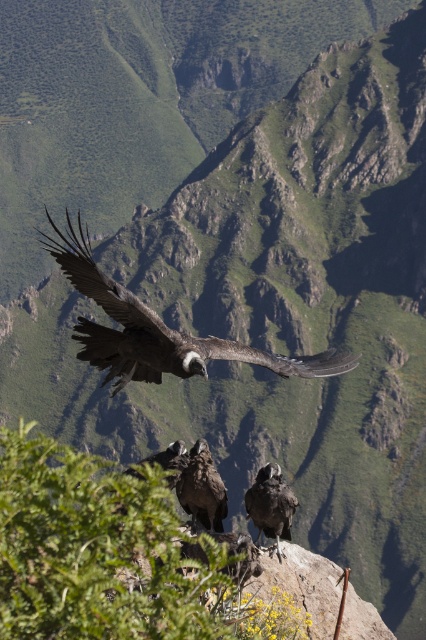
You are a hiker who wants to take a photo of the dark brown feathered eagle at center without the green leafy shrub at center blocking the view. Is this possible given their positions?

The green leafy shrub at center is closer to the viewer than the dark brown feathered eagle at center, so the shrub would block the view of the eagle. You cannot take a photo of the eagle without the shrub blocking it unless you move to a different position.

You are a hiker trying to navigate through the rugged mountains. You have two points marked on your map as point 1 at coordinates point (94, 291) and point 2 at coordinates point (273, 468). Which point is closer to your current position if you are standing at the base of the mountain?

Point (94, 291) is in front of point (273, 468), so it is closer to your current position at the base of the mountain.